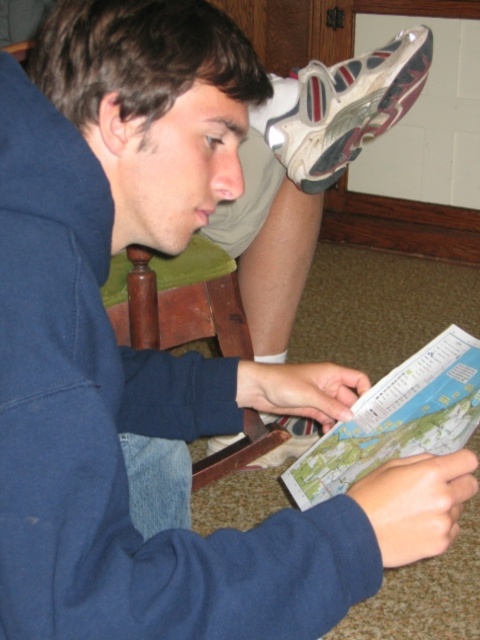
Where is `white mesh shoe at upper right`? This screenshot has width=480, height=640. white mesh shoe at upper right is located at coordinates (343, 106).

Is point (316, 113) in front of point (300, 440)?

Yes, point (316, 113) is in front of point (300, 440).

Which is behind, point (376, 109) or point (298, 454)?

Point (298, 454)

Identify the location of white mesh shoe at upper right. (343, 106).